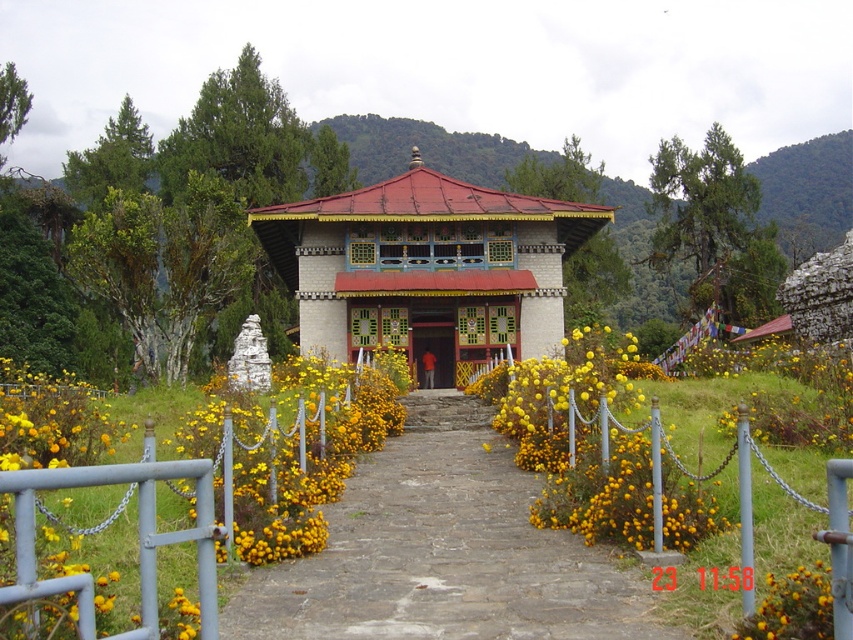
Question: Does stone paved pathway at center have a smaller size compared to matte white gazebo at center?

Choices:
 (A) no
 (B) yes

Answer: (B)

Question: Which object is the farthest from the matte wooden door at center?

Choices:
 (A) matte white gazebo at center
 (B) yellow matte flower at center
 (C) yellow matte flowers at center
 (D) stone paved pathway at center

Answer: (B)

Question: Among these objects, which one is farthest from the camera?

Choices:
 (A) matte white gazebo at center
 (B) stone paved pathway at center

Answer: (A)

Question: Estimate the real-world distances between objects in this image. Which object is farther from the stone paved pathway at center?

Choices:
 (A) matte white gazebo at center
 (B) matte wooden door at center

Answer: (A)

Question: Does stone paved pathway at center appear over yellow matte flower at center?

Choices:
 (A) no
 (B) yes

Answer: (A)

Question: Does matte white gazebo at center appear on the right side of matte wooden door at center?

Choices:
 (A) no
 (B) yes

Answer: (A)